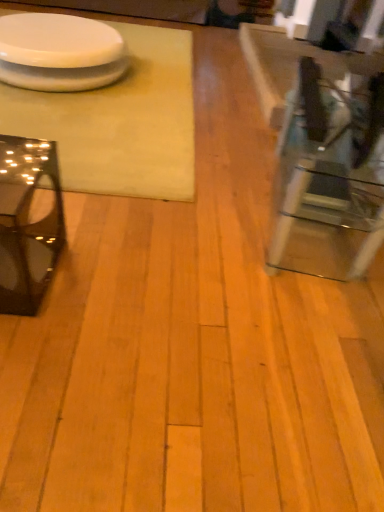
Question: From a real-world perspective, is white glossy platter at upper left below glossy black glass table at left, the second table from the left?

Choices:
 (A) yes
 (B) no

Answer: (A)

Question: Is white glossy platter at upper left facing towards glossy black glass table at left, the second table from the left?

Choices:
 (A) no
 (B) yes

Answer: (A)

Question: Can you confirm if white glossy platter at upper left is smaller than glossy black glass table at left, which is the second table in right-to-left order?

Choices:
 (A) yes
 (B) no

Answer: (B)

Question: Is white glossy platter at upper left completely or partially outside of glossy black glass table at left, the second table from the left?

Choices:
 (A) no
 (B) yes

Answer: (B)

Question: Is white glossy platter at upper left further to camera compared to glossy black glass table at left, the second table from the left?

Choices:
 (A) yes
 (B) no

Answer: (A)

Question: Can you confirm if white glossy platter at upper left is shorter than glossy black glass table at left, the second table from the left?

Choices:
 (A) no
 (B) yes

Answer: (B)

Question: Does glossy black glass table at left, the second table from the left, appear on the left side of clear glass table at right, the first table in the right-to-left sequence?

Choices:
 (A) yes
 (B) no

Answer: (A)

Question: Are glossy black glass table at left, which is the second table in right-to-left order, and clear glass table at right, the first table in the right-to-left sequence, beside each other?

Choices:
 (A) yes
 (B) no

Answer: (B)

Question: From a real-world perspective, does glossy black glass table at left, which is the second table in right-to-left order, sit lower than clear glass table at right, the first table in the right-to-left sequence?

Choices:
 (A) no
 (B) yes

Answer: (B)

Question: Considering the relative positions of glossy black glass table at left, the second table from the left, and clear glass table at right, which is the third table from left to right, in the image provided, is glossy black glass table at left, the second table from the left, behind clear glass table at right, which is the third table from left to right,?

Choices:
 (A) no
 (B) yes

Answer: (A)

Question: From a real-world perspective, is glossy black glass table at left, the second table from the left, physically above clear glass table at right, the first table in the right-to-left sequence?

Choices:
 (A) no
 (B) yes

Answer: (A)

Question: Is there a large distance between glossy black glass table at left, the second table from the left, and clear glass table at right, which is the third table from left to right?

Choices:
 (A) no
 (B) yes

Answer: (B)

Question: Are glossy black glass table at left, the second table from the left, and white matte table at upper left, which ranks as the third table in right-to-left order, far apart?

Choices:
 (A) yes
 (B) no

Answer: (B)